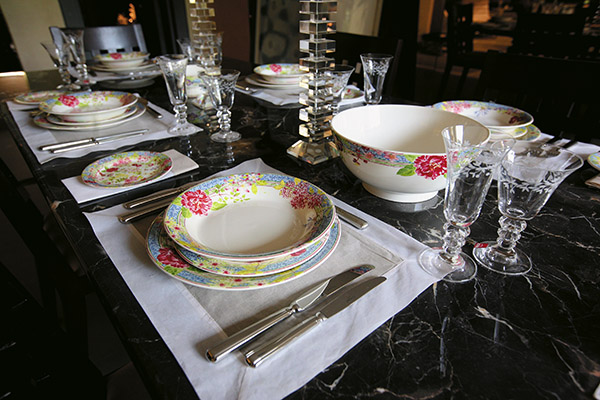
This screenshot has height=400, width=600. Find the location of `place settings`. place settings is located at coordinates (142, 120), (275, 95), (546, 141), (366, 251), (135, 63).